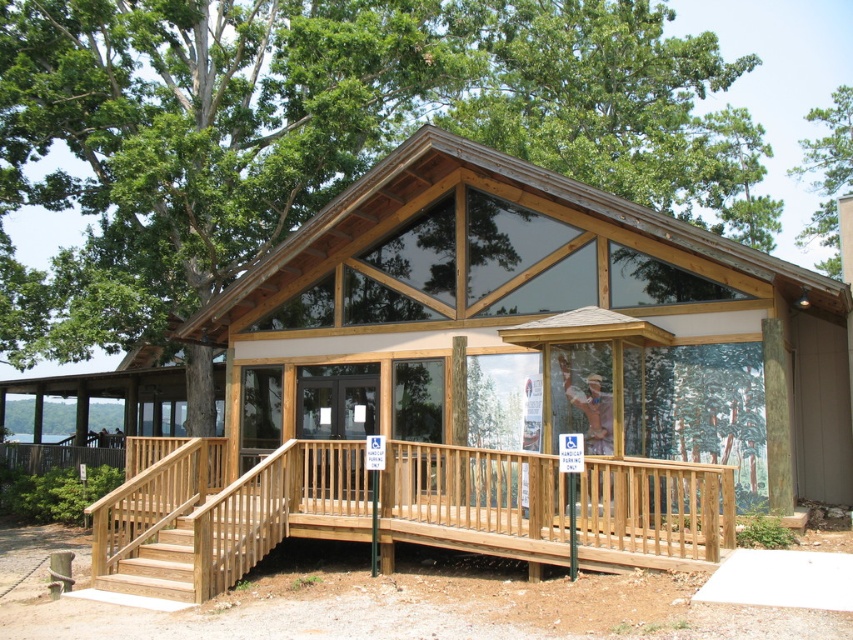
Question: Can you confirm if natural wood cabin at center is smaller than green leafy tree at upper right?

Choices:
 (A) no
 (B) yes

Answer: (B)

Question: Which is nearer to the wooden ramp at lower left?

Choices:
 (A) natural wood cabin at center
 (B) green leafy tree at upper right

Answer: (A)

Question: Which object appears closest to the camera in this image?

Choices:
 (A) green leafy tree at upper right
 (B) natural wood cabin at center
 (C) wooden ramp at lower left

Answer: (B)

Question: Among these objects, which one is farthest from the camera?

Choices:
 (A) natural wood cabin at center
 (B) green leafy tree at upper right

Answer: (B)

Question: Can you confirm if natural wood cabin at center is thinner than wooden ramp at lower left?

Choices:
 (A) yes
 (B) no

Answer: (B)

Question: Can you confirm if natural wood cabin at center is positioned above wooden ramp at lower left?

Choices:
 (A) yes
 (B) no

Answer: (A)